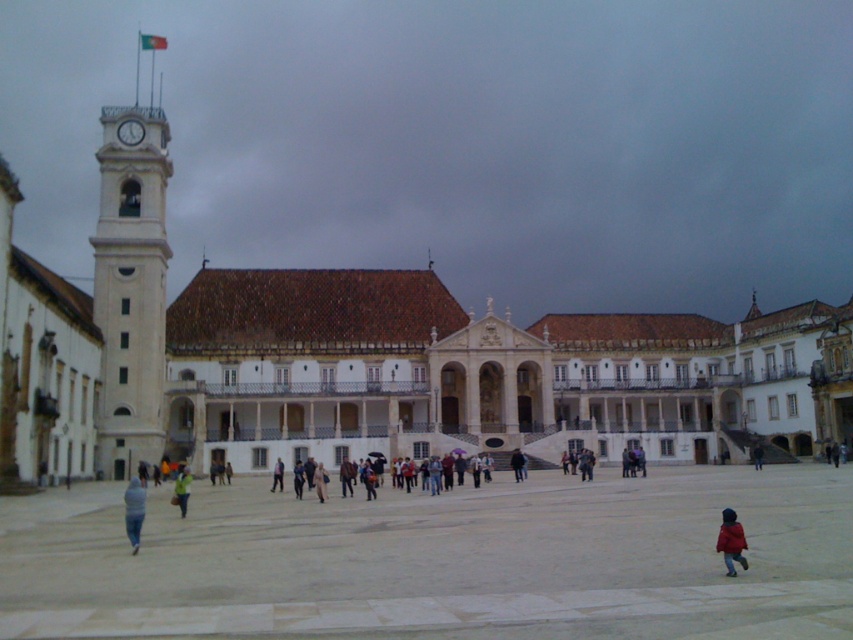
You are standing in the square in front of the historic building and notice two people wearing coats. One is wearing a red woolen coat at lower right and the other a light brown leather jacket at center. Which person is nearer to you?

The red woolen coat at lower right is closer to the viewer than the light brown leather jacket at center, so the person in the red woolen coat at lower right is nearer to you.

You are a photographer planning to capture a photo of the crowd in front of the historic building. You notice two people wearing a red woolen coat at lower right and a light brown leather jacket at center. Which of these two items of clothing is taller in the image?

The red woolen coat at lower right is much taller than the light brown leather jacket at center.